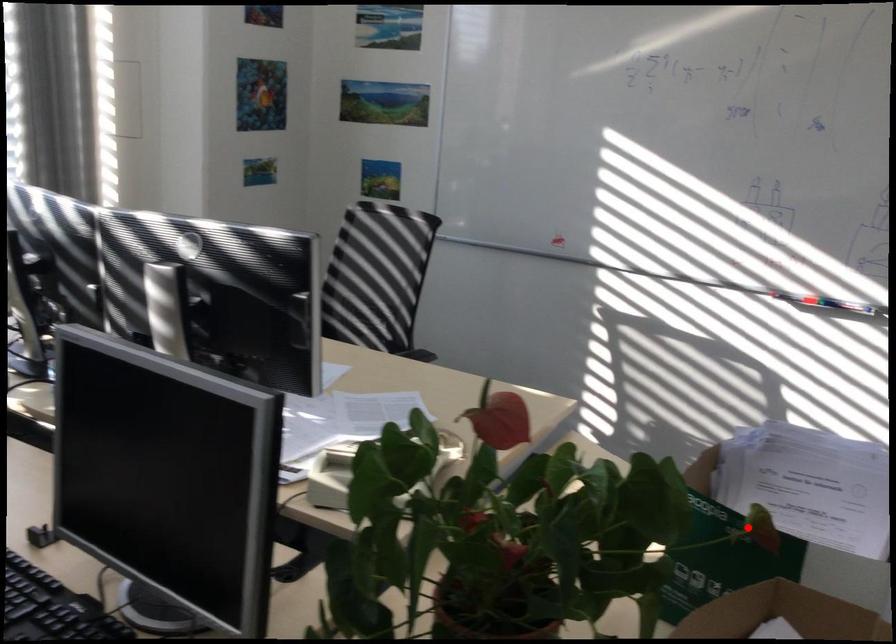
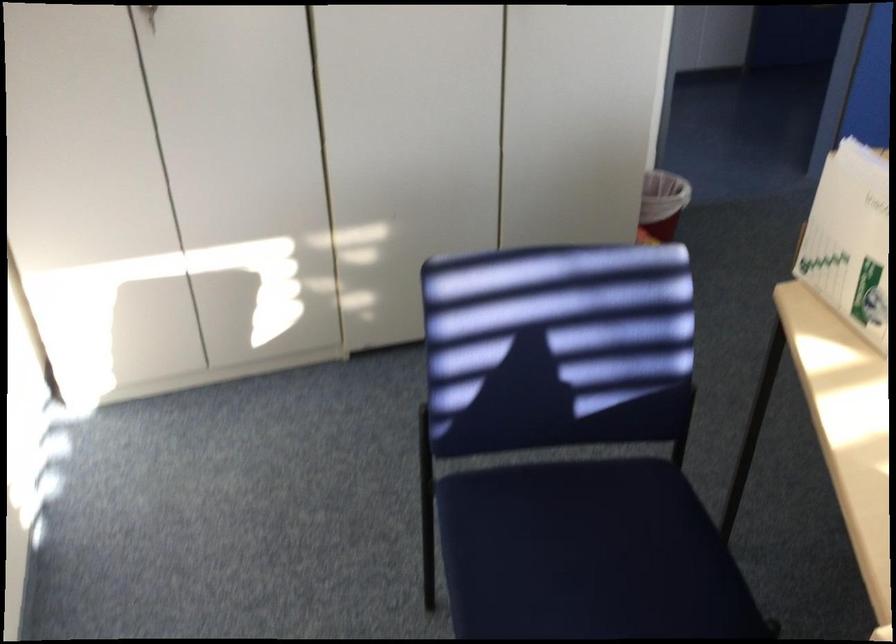
Find the pixel in the second image that matches the highlighted location in the first image.

(849, 240)